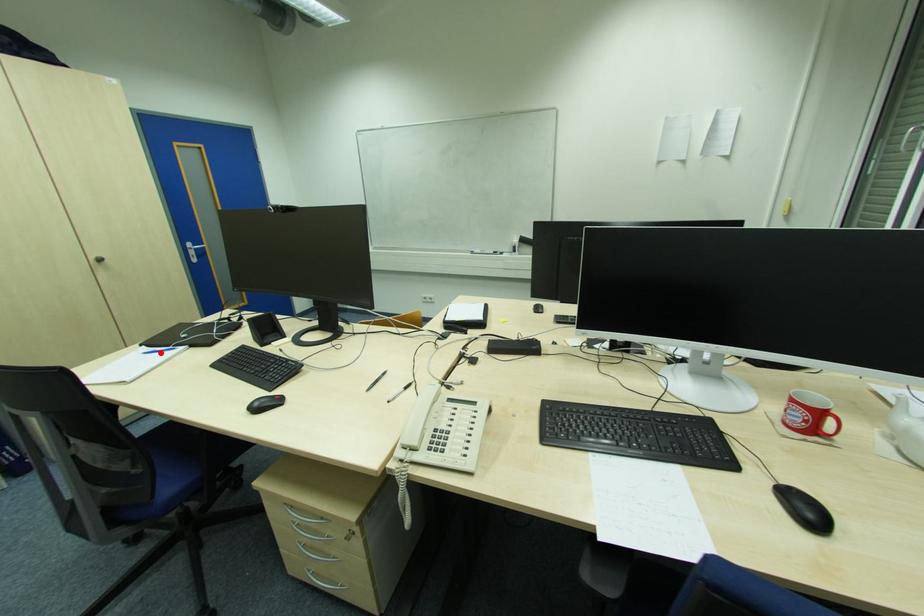
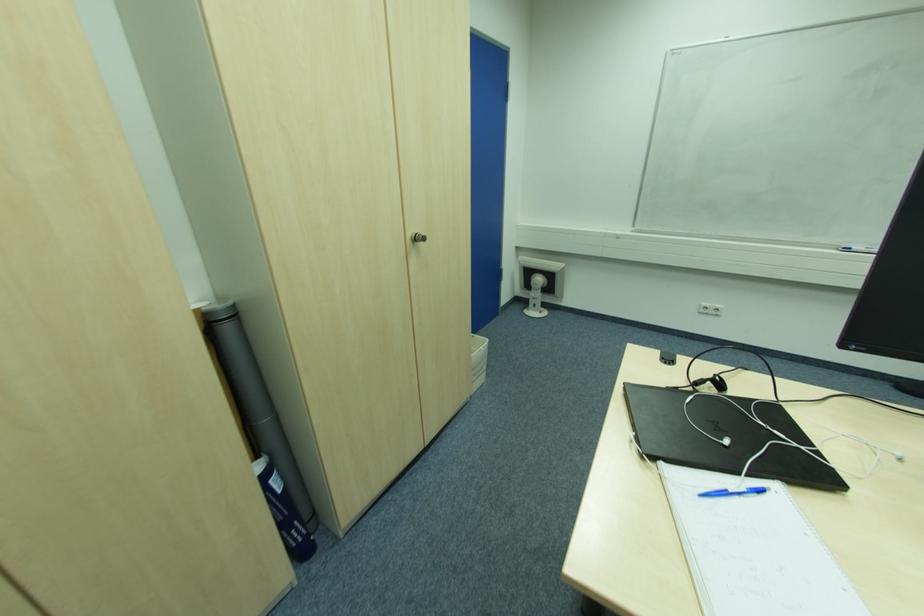
In the second image, find the point that corresponds to the highlighted location in the first image.

(727, 493)